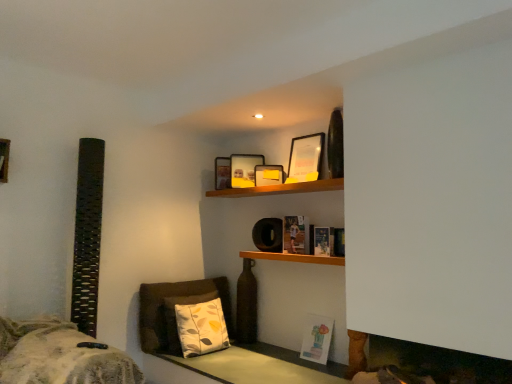
Question: Considering the positions of matte paper book at center, marked as the 3th book in a bottom-to-top arrangement, and fuzzy gray blanket at lower left in the image, is matte paper book at center, marked as the 3th book in a bottom-to-top arrangement, taller or shorter than fuzzy gray blanket at lower left?

Choices:
 (A) tall
 (B) short

Answer: (B)

Question: Is point (302, 221) positioned closer to the camera than point (52, 369)?

Choices:
 (A) farther
 (B) closer

Answer: (A)

Question: Estimate the real-world distances between objects in this image. Which object is closer to the matte yellow picture frame at upper center, which is the second picture frame from right to left?

Choices:
 (A) matte paper book at center, marked as the 3th book in a bottom-to-top arrangement
 (B) white fabric pillow at lower center
 (C) fuzzy gray blanket at lower left
 (D) matte glass picture frame at upper center, which is counted as the 3th picture frame, starting from the front
 (E) wooden shelf at upper center, the second shelf when ordered from bottom to top

Answer: (D)

Question: Based on their relative distances, which object is farther from the wooden shelf at upper center, marked as the 2th shelf in a top-to-bottom arrangement?

Choices:
 (A) pastel paper book at lower right, the third book from the top
 (B) matte yellow picture frame at upper center, the second picture frame when ordered from left to right
 (C) matte glass picture frame at upper center, the 1th picture frame viewed from the left
 (D) matte wooden picture frame at upper center, the first picture frame positioned from the right
 (E) hardcover book at center, the 2th book from the bottom

Answer: (D)